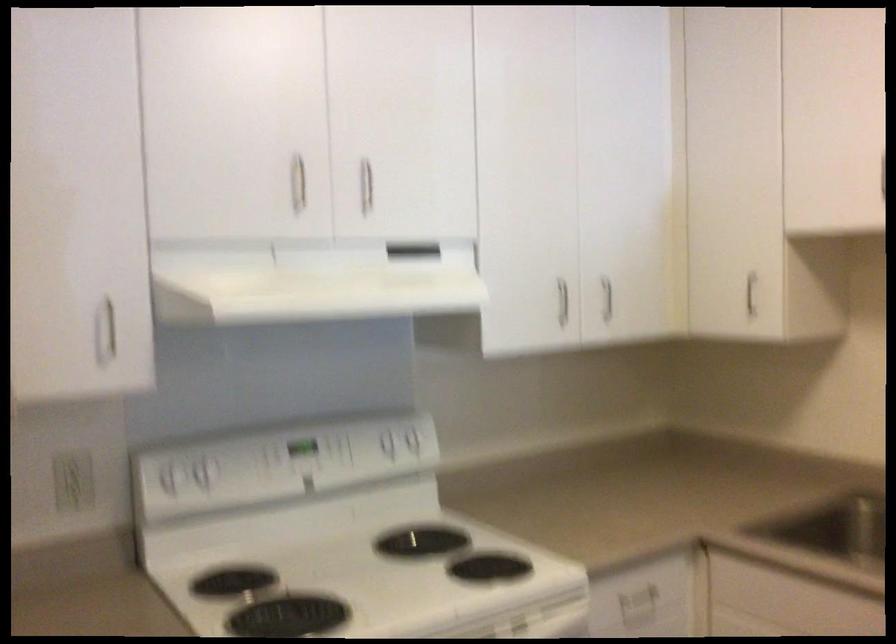
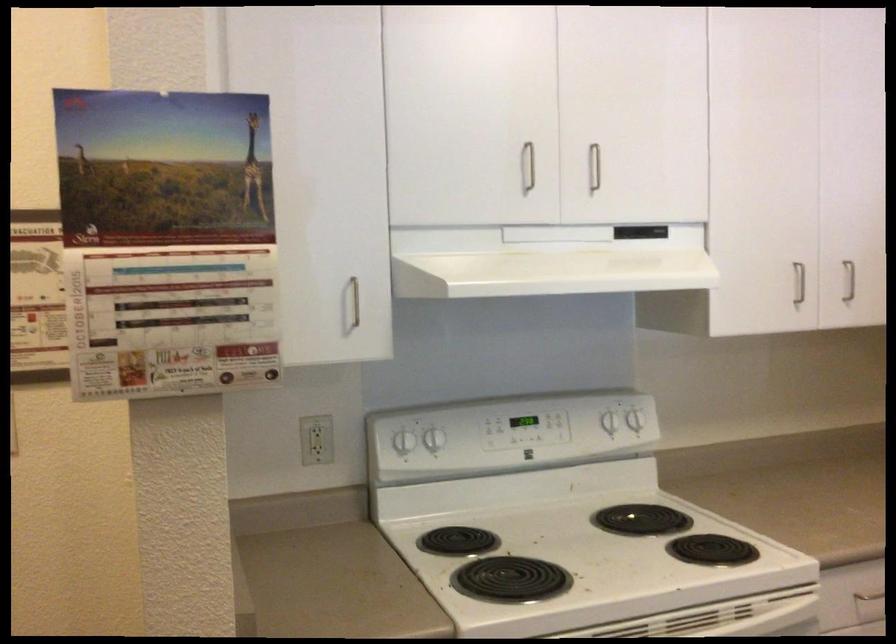
Locate, in the second image, the point that corresponds to (415,440) in the first image.

(634, 420)